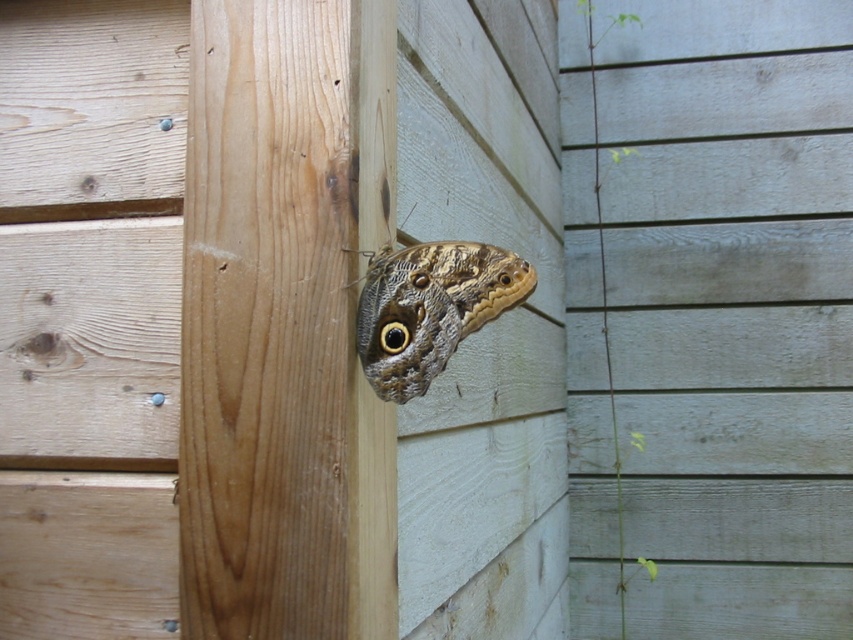
You are an entomologist observing the natural wood at center and the brown textured butterfly at center. Which object is located to the left of the other?

The natural wood at center is positioned on the left side of brown textured butterfly at center.

You are an entomologist studying the positioning of insects on wooden structures. You observe a natural wood at center and a brown textured butterfly at center. Which object is taller?

The natural wood at center is taller than the brown textured butterfly at center.

You are an entomologist observing a butterfly in a natural setting. You see the natural wood at center and the brown textured butterfly at center. Which object takes up more space in the image?

The natural wood at center is bigger than the brown textured butterfly at center, so it takes up more space in the image.